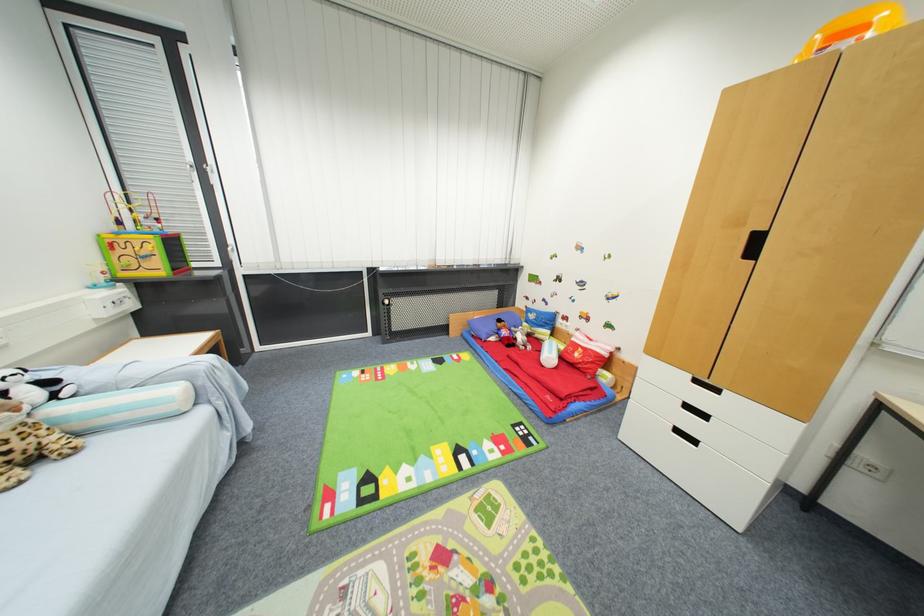
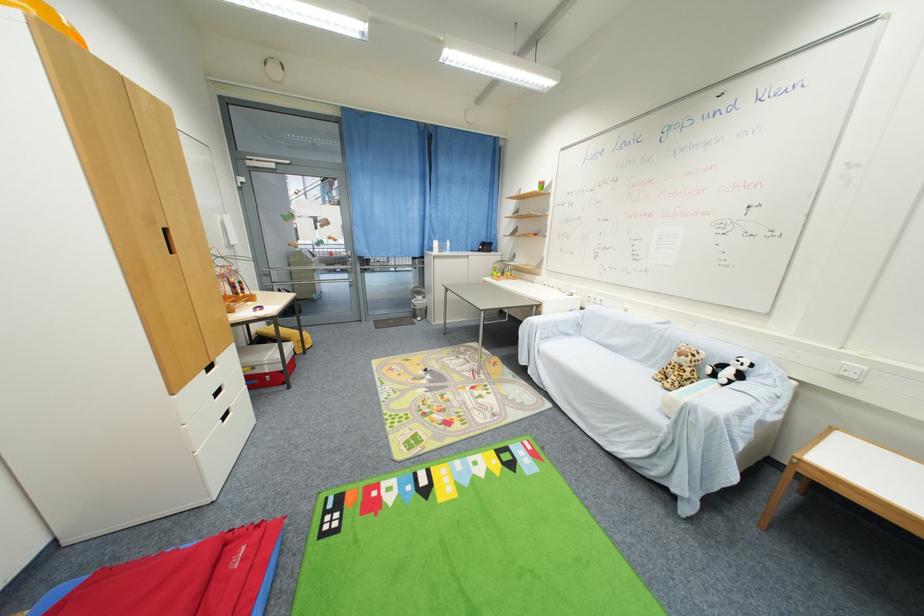
The point at (62,448) is marked in the first image. Where is the corresponding point in the second image?

(675, 382)